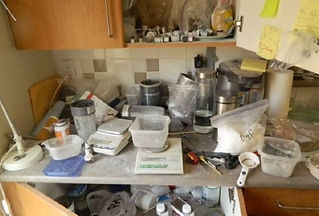
Find the location of a particular element. The image size is (319, 216). cabinet handle is located at coordinates (107, 13).